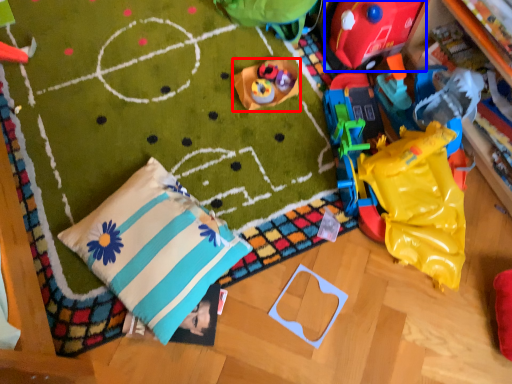
Question: Which object is further to the camera taking this photo, toy (highlighted by a red box) or toy (highlighted by a blue box)?

Choices:
 (A) toy
 (B) toy

Answer: (A)